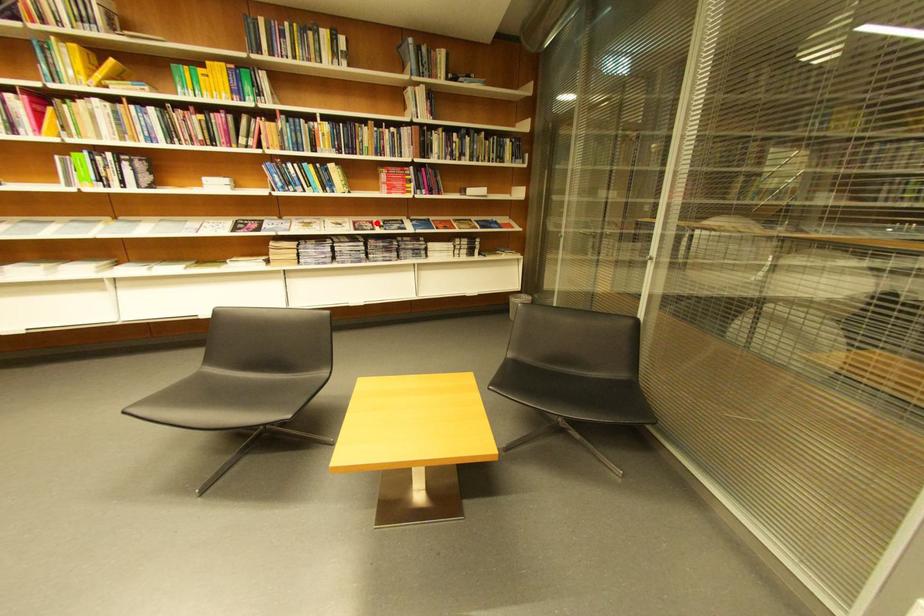
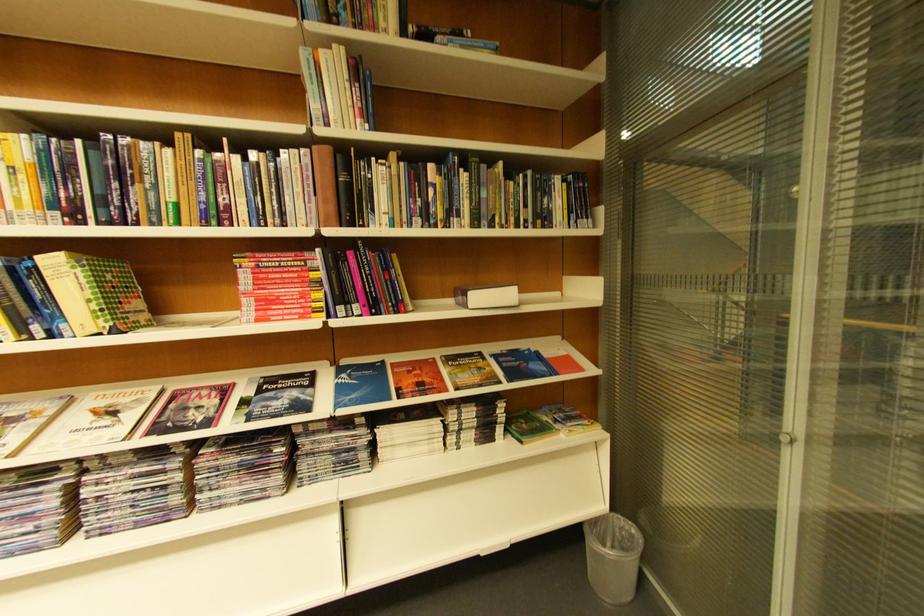
Where in the second image is the point corresponding to the highlighted location from the first image?

(224, 389)